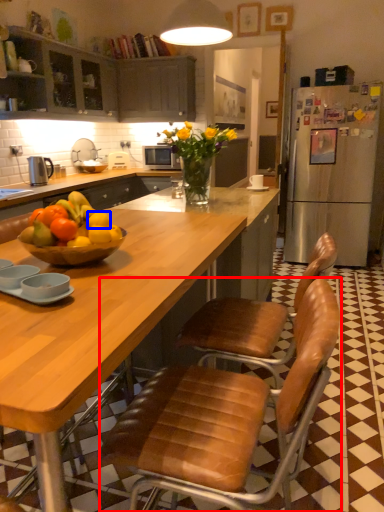
Question: Which of the following is the closest to the observer, chair (highlighted by a red box) or orange (highlighted by a blue box)?

Choices:
 (A) chair
 (B) orange

Answer: (A)